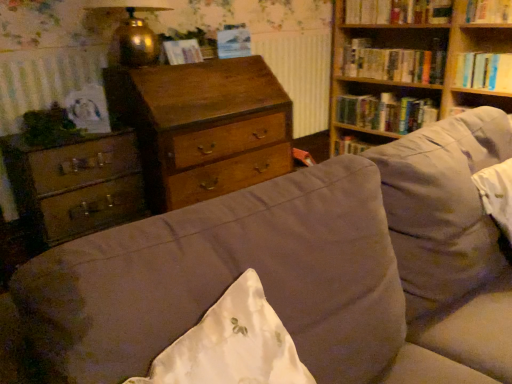
What do you see at coordinates (233, 42) in the screenshot?
I see `matte paper at upper center, which is counted as the second paperback book, starting from the front` at bounding box center [233, 42].

Describe the element at coordinates (394, 62) in the screenshot. Image resolution: width=512 pixels, height=384 pixels. I see `hardcover books at upper right, which is the 2th book in top-to-bottom order` at that location.

You are a GUI agent. You are given a task and a screenshot of the screen. Output one action in this format:
    pyautogui.click(x=<x>, y=<y>)
    Task: Click on the wooden chest of drawers at left, marked as the 2th chest of drawers in a right-to-left arrangement
    This screenshot has width=512, height=384.
    Given the screenshot: What is the action you would take?
    pyautogui.click(x=75, y=185)

Does point (238, 32) appear closer or farther from the camera than point (444, 84)?

Point (238, 32) is closer to the camera than point (444, 84).

Could you tell me if matte paper at upper center, acting as the first paperback book starting from the right, is facing wooden bookshelf at upper right?

No, matte paper at upper center, acting as the first paperback book starting from the right, does not turn towards wooden bookshelf at upper right.

Does matte paper at upper center, which is counted as the second paperback book, starting from the front, have a smaller size compared to wooden bookshelf at upper right?

Correct, matte paper at upper center, which is counted as the second paperback book, starting from the front, occupies less space than wooden bookshelf at upper right.

Considering the sizes of objects matte paper at upper center, which is counted as the second paperback book, starting from the front, and wooden bookshelf at upper right in the image provided, who is shorter, matte paper at upper center, which is counted as the second paperback book, starting from the front, or wooden bookshelf at upper right?

With less height is matte paper at upper center, which is counted as the second paperback book, starting from the front.

Is suede-like beige couch at center next to wooden bookshelf at upper right and touching it?

There is a gap between suede-like beige couch at center and wooden bookshelf at upper right.

Does suede-like beige couch at center appear on the left side of wooden bookshelf at upper right?

Correct, you'll find suede-like beige couch at center to the left of wooden bookshelf at upper right.

Measure the distance between suede-like beige couch at center and wooden bookshelf at upper right.

suede-like beige couch at center and wooden bookshelf at upper right are 5.87 feet apart.

Based on the photo, between suede-like beige couch at center and wooden bookshelf at upper right, which one is positioned behind?

wooden bookshelf at upper right is behind.

Would you consider wooden bookshelf at upper right to be distant from wooden chest of drawers at left, acting as the 1th chest of drawers starting from the left?

Indeed, wooden bookshelf at upper right is not near wooden chest of drawers at left, acting as the 1th chest of drawers starting from the left.

This screenshot has width=512, height=384. I want to click on bookcase above the wooden chest of drawers at left, acting as the 1th chest of drawers starting from the left (from the image's perspective), so click(413, 48).

Does point (482, 96) come in front of point (22, 183)?

No.

Is wooden bookshelf at upper right not within wooden chest of drawers at left, marked as the 2th chest of drawers in a right-to-left arrangement?

Indeed, wooden bookshelf at upper right is completely outside wooden chest of drawers at left, marked as the 2th chest of drawers in a right-to-left arrangement.

Based on the photo, how different are the orientations of wooden bookshelf at upper right and suede-like beige couch at center in degrees?

The angular difference between wooden bookshelf at upper right and suede-like beige couch at center is 90.9 degrees.

Would you say suede-like beige couch at center is part of wooden bookshelf at upper right's contents?

No, wooden bookshelf at upper right does not contain suede-like beige couch at center.

Is wooden bookshelf at upper right positioned in front of suede-like beige couch at center?

No, wooden bookshelf at upper right is further to the viewer.

Is wooden bookshelf at upper right at the left side of wooden chest of drawers at center, marked as the 2th chest of drawers in a left-to-right arrangement?

Incorrect, wooden bookshelf at upper right is not on the left side of wooden chest of drawers at center, marked as the 2th chest of drawers in a left-to-right arrangement.

Is wooden bookshelf at upper right positioned in front of wooden chest of drawers at center, the 1th chest of drawers viewed from the right?

Yes.

How different are the orientations of wooden bookshelf at upper right and wooden chest of drawers at center, marked as the 2th chest of drawers in a left-to-right arrangement, in degrees?

There is a 90-degree angle between the facing directions of wooden bookshelf at upper right and wooden chest of drawers at center, marked as the 2th chest of drawers in a left-to-right arrangement.

Is there a large distance between wooden bookshelf at upper right and wooden chest of drawers at center, marked as the 2th chest of drawers in a left-to-right arrangement?

That's right, there is a large distance between wooden bookshelf at upper right and wooden chest of drawers at center, marked as the 2th chest of drawers in a left-to-right arrangement.

Is wooden chest of drawers at center, marked as the 2th chest of drawers in a left-to-right arrangement, not within matte paper at upper center, which is counted as the second paperback book, starting from the front?

Yes.

Can you confirm if wooden chest of drawers at center, marked as the 2th chest of drawers in a left-to-right arrangement, is taller than matte paper at upper center, the 1th paperback book from the back?

Yes, wooden chest of drawers at center, marked as the 2th chest of drawers in a left-to-right arrangement, is taller than matte paper at upper center, the 1th paperback book from the back.

Find the location of a particular element. the 1st chest of drawers in front of the matte paper at upper center, which appears as the second paperback book when viewed from the left is located at coordinates (203, 127).

Can you confirm if wooden chest of drawers at center, the 1th chest of drawers viewed from the right, is thinner than matte paper at upper center, acting as the first paperback book starting from the right?

No, wooden chest of drawers at center, the 1th chest of drawers viewed from the right, is not thinner than matte paper at upper center, acting as the first paperback book starting from the right.

Is the position of wooden bookshelf at upper right more distant than that of matte paper at center, which is the 1th paperback book from left to right?

Yes, wooden bookshelf at upper right is further from the camera.

Is wooden bookshelf at upper right aimed at matte paper at center, marked as the second paperback book in a back-to-front arrangement?

Yes, wooden bookshelf at upper right is oriented towards matte paper at center, marked as the second paperback book in a back-to-front arrangement.

Is wooden bookshelf at upper right not within matte paper at center, acting as the second paperback book starting from the right?

Indeed, wooden bookshelf at upper right is completely outside matte paper at center, acting as the second paperback book starting from the right.

Locate an element on the screen. The image size is (512, 384). shelf that is under the matte paper at upper center, which appears as the second paperback book when viewed from the left (from a real-world perspective) is located at coordinates (473, 51).

Find the location of a particular element. studio couch in front of the wooden bookshelf at upper right is located at coordinates (296, 274).

In the scene shown: From the image, which object appears to be nearer to wooden chest of drawers at center, marked as the 2th chest of drawers in a left-to-right arrangement, suede-like beige couch at center or hardcover books at upper right, which is the 2th book in top-to-bottom order?

suede-like beige couch at center is closer to wooden chest of drawers at center, marked as the 2th chest of drawers in a left-to-right arrangement.

Estimate the real-world distances between objects in this image. Which object is closer to matte paper at upper center, which appears as the second paperback book when viewed from the left, gold metallic lamp at upper left or hardcover books at upper right, which is the 2th book in top-to-bottom order?

Based on the image, gold metallic lamp at upper left appears to be nearer to matte paper at upper center, which appears as the second paperback book when viewed from the left.

Based on their spatial positions, is wooden bookshelf at upper right or wooden chest of drawers at left, marked as the 2th chest of drawers in a right-to-left arrangement, closer to matte paper at upper center, the 1th paperback book from the back?

wooden chest of drawers at left, marked as the 2th chest of drawers in a right-to-left arrangement, lies closer to matte paper at upper center, the 1th paperback book from the back, than the other object.

When comparing their distances from wooden chest of drawers at left, marked as the 2th chest of drawers in a right-to-left arrangement, does hardcover book at upper right, placed as the 2th book when sorted from bottom to top, or wooden bookshelf at upper right seem further?

hardcover book at upper right, placed as the 2th book when sorted from bottom to top, is further to wooden chest of drawers at left, marked as the 2th chest of drawers in a right-to-left arrangement.

From the picture: Based on their spatial positions, is wooden bookshelf at upper right or gold metallic lamp at upper left further from matte paper at center, acting as the second paperback book starting from the right?

Based on the image, wooden bookshelf at upper right appears to be further to matte paper at center, acting as the second paperback book starting from the right.

Looking at the image, which one is located further to hardcover book at upper right, the fourth book viewed from the top, hardcover book at upper right, acting as the 1th book starting from the top, or wooden chest of drawers at center, the 1th chest of drawers viewed from the right?

Based on the image, wooden chest of drawers at center, the 1th chest of drawers viewed from the right, appears to be further to hardcover book at upper right, the fourth book viewed from the top.

From the image, which object appears to be nearer to hardcover books at upper right, which is the 2th book in top-to-bottom order, wooden chest of drawers at center, marked as the 2th chest of drawers in a left-to-right arrangement, or hardcover book at upper right, the first book when ordered from bottom to top?

The object closer to hardcover books at upper right, which is the 2th book in top-to-bottom order, is hardcover book at upper right, the first book when ordered from bottom to top.

Which object lies nearer to the anchor point wooden bookshelf at upper right, wooden chest of drawers at left, acting as the 1th chest of drawers starting from the left, or wooden chest of drawers at center, the 1th chest of drawers viewed from the right?

wooden chest of drawers at center, the 1th chest of drawers viewed from the right.

This screenshot has height=384, width=512. Identify the location of studio couch between wooden chest of drawers at left, acting as the 1th chest of drawers starting from the left, and wooden bookshelf at upper right, in the horizontal direction. (296, 274).

You are a GUI agent. You are given a task and a screenshot of the screen. Output one action in this format:
    pyautogui.click(x=<x>, y=<y>)
    Task: Click on the book between matte paper at center, which is the 1th paperback book from left to right, and hardcover books at upper right, the 3th book in the bottom-to-top sequence, from left to right
    
    Given the screenshot: What is the action you would take?
    pyautogui.click(x=398, y=11)

Identify the location of chest of drawers between wooden chest of drawers at left, marked as the 2th chest of drawers in a right-to-left arrangement, and wooden bookshelf at upper right. Image resolution: width=512 pixels, height=384 pixels. (203, 127).

I want to click on paperback book between matte paper at center, acting as the second paperback book starting from the right, and wooden bookshelf at upper right, so click(x=233, y=42).